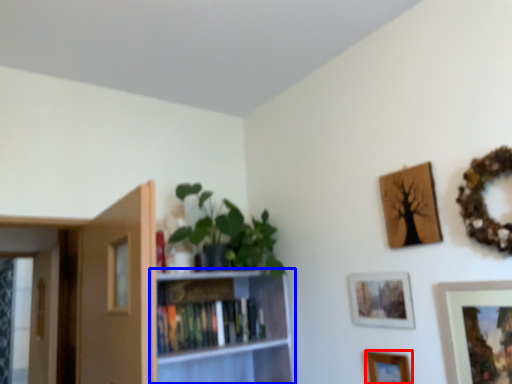
Question: Which point is closer to the camera, picture frame (highlighted by a red box) or bookcase (highlighted by a blue box)?

Choices:
 (A) picture frame
 (B) bookcase

Answer: (A)